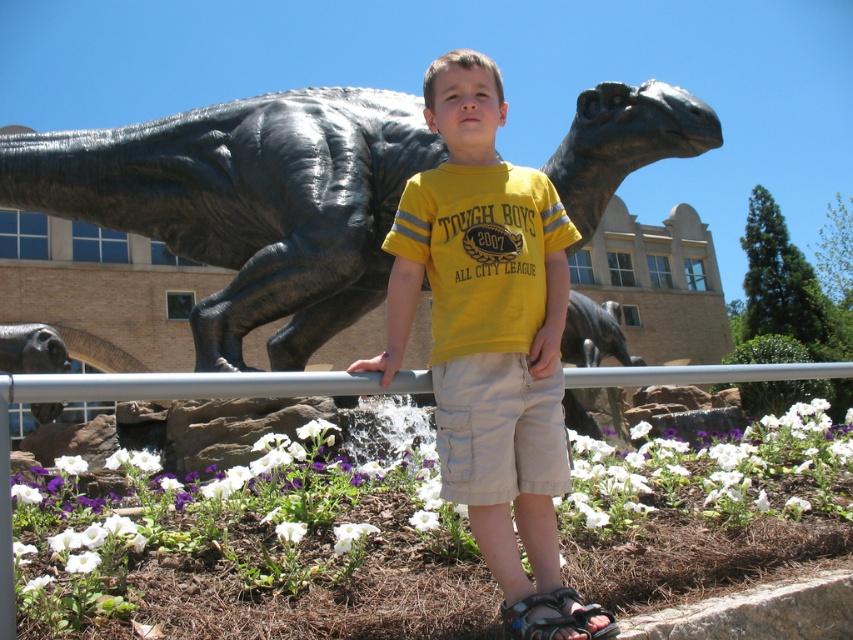
Question: Which object is the farthest from the black synthetic sandal at lower center?

Choices:
 (A) shiny black statue at lower left
 (B) black polished statue at upper center

Answer: (B)

Question: Can you confirm if yellow cotton shirt at center is smaller than shiny black statue at lower left?

Choices:
 (A) no
 (B) yes

Answer: (B)

Question: Which point is closer to the camera?

Choices:
 (A) (53, 369)
 (B) (537, 602)
 (C) (520, 401)

Answer: (B)

Question: Does black polished statue at upper center have a greater width compared to black synthetic sandal at lower center?

Choices:
 (A) yes
 (B) no

Answer: (A)

Question: Which of these objects is positioned farthest from the black polished statue at upper center?

Choices:
 (A) yellow cotton shirt at center
 (B) black synthetic sandal at lower center
 (C) shiny black statue at lower left

Answer: (C)

Question: Can you confirm if black polished statue at upper center is wider than shiny black statue at lower left?

Choices:
 (A) yes
 (B) no

Answer: (B)